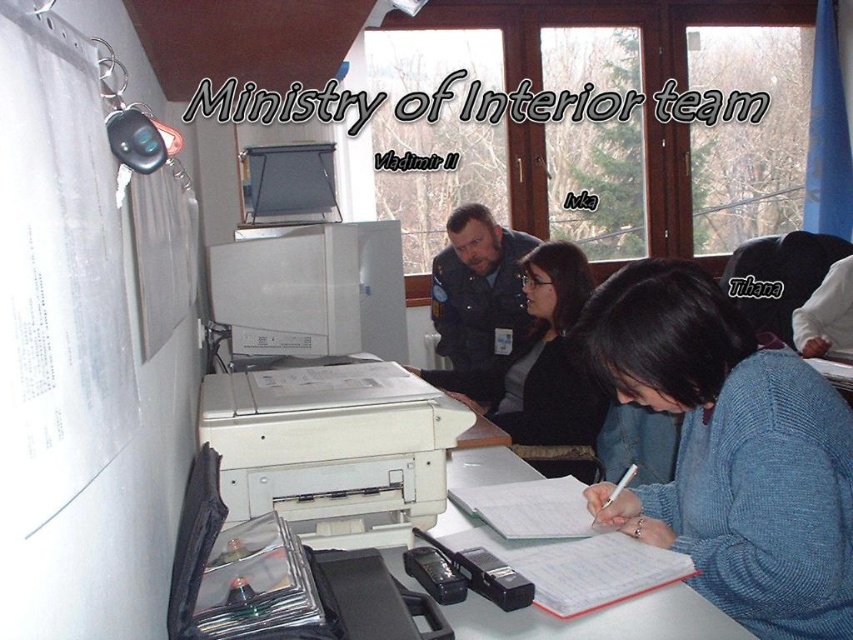
Looking at this image, between white plastic printer at center and black plastic text at upper center, which one appears on the left side from the viewer's perspective?

From the viewer's perspective, white plastic printer at center appears more on the left side.

Is point (241, 420) positioned in front of point (456, 70)?

That is True.

The width and height of the screenshot is (853, 640). What are the coordinates of `white plastic printer at center` in the screenshot? It's located at (332, 449).

Is point (292, 452) more distant than point (563, 250)?

No, (292, 452) is in front of (563, 250).

Find the location of `white plastic printer at center`. white plastic printer at center is located at coordinates (332, 449).

Is point (688, 92) closer to camera compared to point (526, 248)?

No, (688, 92) is further to viewer.

Can you confirm if black plastic text at upper center is positioned below dark blue uniform at center?

Actually, black plastic text at upper center is above dark blue uniform at center.

Which is behind, point (296, 104) or point (515, 259)?

The point (515, 259) is behind.

Find the location of `black plastic text at upper center`. black plastic text at upper center is located at coordinates (281, 104).